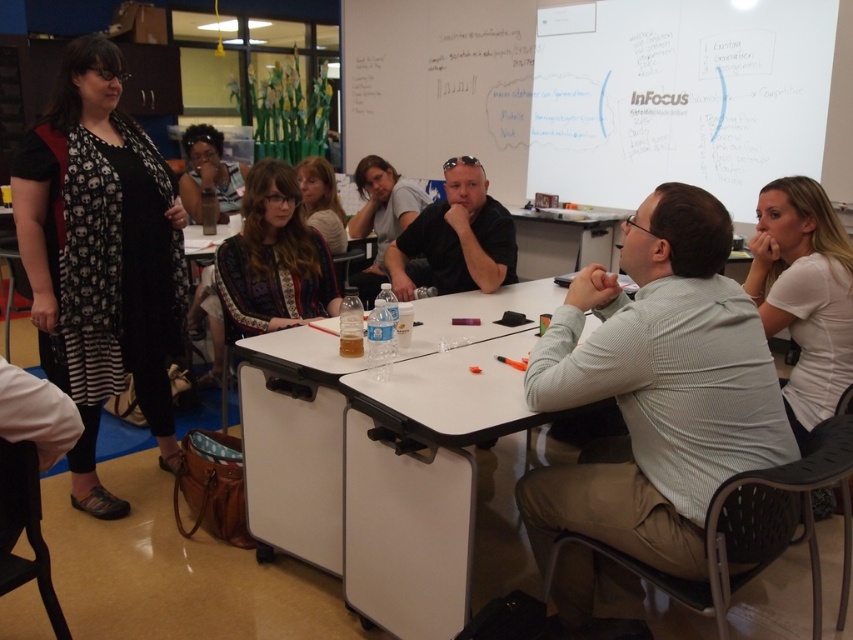
You are standing in the classroom and want to pick up the gray striped shirt at center. Can you reach it without moving the white plastic table at center?

The gray striped shirt at center is closer to the viewer than the white plastic table at center, so you can reach it without moving the table.

What is the 2D coordinate of the patterned fabric shirt at center?

The patterned fabric shirt at center is located at the 2D coordinate point of [271,260].